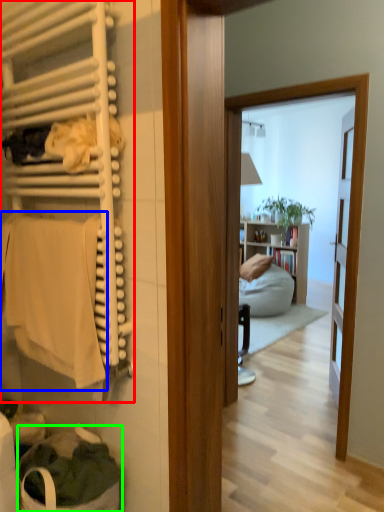
Question: Which object is the closest to the closet (highlighted by a red box)? Choose among these: bath towel (highlighted by a blue box) or laundry basket (highlighted by a green box).

Choices:
 (A) bath towel
 (B) laundry basket

Answer: (A)